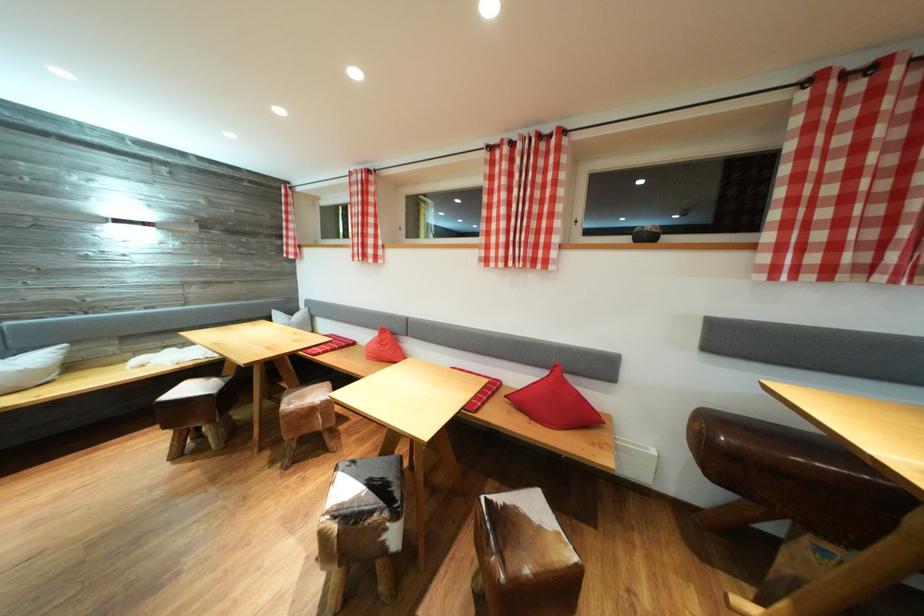
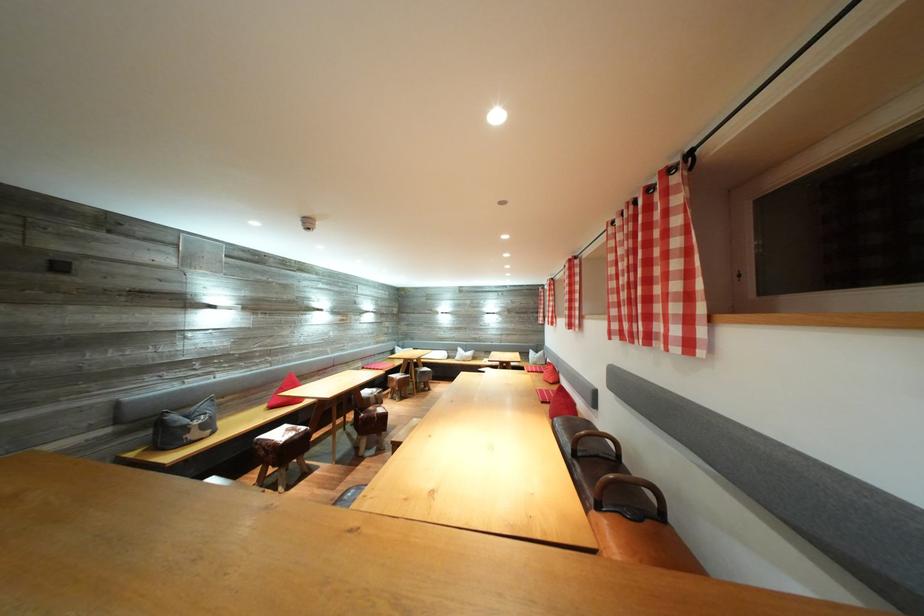
In the second image, find the point that corresponds to point (395, 341) in the first image.

(557, 373)